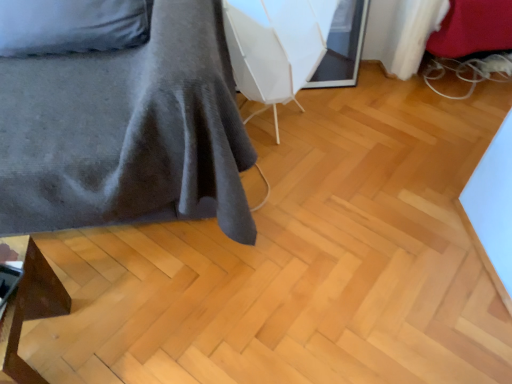
This screenshot has height=384, width=512. Find the location of `free space to the right of matte brown wooden stool at lower left, which ranks as the 2th furniture in top-to-bottom order`. free space to the right of matte brown wooden stool at lower left, which ranks as the 2th furniture in top-to-bottom order is located at coordinates (117, 339).